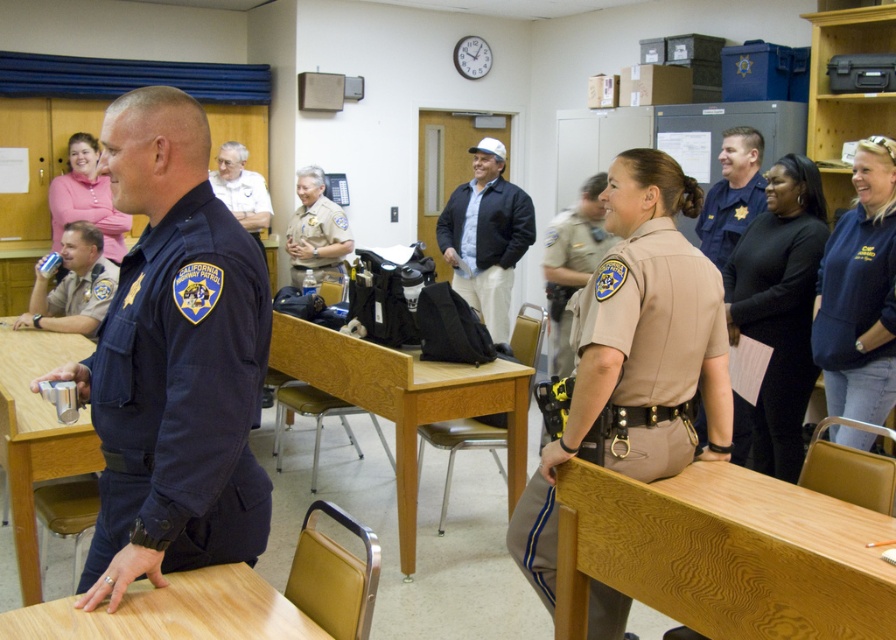
Between point (759, 205) and point (302, 276), which one is positioned in front?

Point (759, 205) is more forward.

Is dark blue uniform at center taller than khaki fabric uniform at center?

Yes.

Where is `dark blue uniform at center`? The image size is (896, 640). dark blue uniform at center is located at coordinates (731, 195).

The height and width of the screenshot is (640, 896). I want to click on dark blue uniform at center, so click(x=731, y=195).

Does navy blue fleece sweatshirt at right appear on the left side of metallic silver cup at left?

Incorrect, navy blue fleece sweatshirt at right is not on the left side of metallic silver cup at left.

Is navy blue fleece sweatshirt at right wider than metallic silver cup at left?

Incorrect, navy blue fleece sweatshirt at right's width does not surpass metallic silver cup at left's.

Image resolution: width=896 pixels, height=640 pixels. Find the location of `navy blue fleece sweatshirt at right`. navy blue fleece sweatshirt at right is located at coordinates (856, 316).

At what (x,y) coordinates should I click in order to perform the action: click on navy blue fleece sweatshirt at right. Please return your answer as a coordinate pair (x, y). This screenshot has width=896, height=640. Looking at the image, I should click on (856, 316).

Is wooden table at lower left closer to the viewer compared to matte brown uniform at left?

Yes.

Where is `wooden table at lower left`? wooden table at lower left is located at coordinates (173, 611).

Is point (33, 627) in front of point (27, 312)?

Yes, it is in front of point (27, 312).

Find the location of a particular element. The height and width of the screenshot is (640, 896). wooden table at lower left is located at coordinates (173, 611).